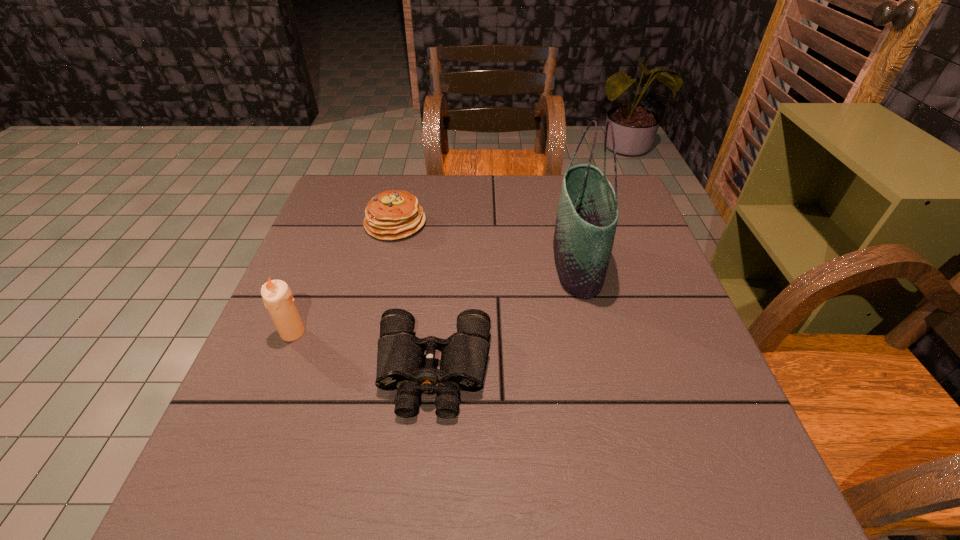
Locate which object is the closest to the pancake. Please provide its 2D coordinates. Your answer should be formatted as a tuple, i.e. [(x, y)], where the tuple contains the x and y coordinates of a point satisfying the conditions above.

[(277, 297)]

The image size is (960, 540). Find the location of `free point that satisfies the following two spatial constraints: 1. on the back side of the second tallest object; 2. on the left side of the tote bag`. free point that satisfies the following two spatial constraints: 1. on the back side of the second tallest object; 2. on the left side of the tote bag is located at coordinates (321, 264).